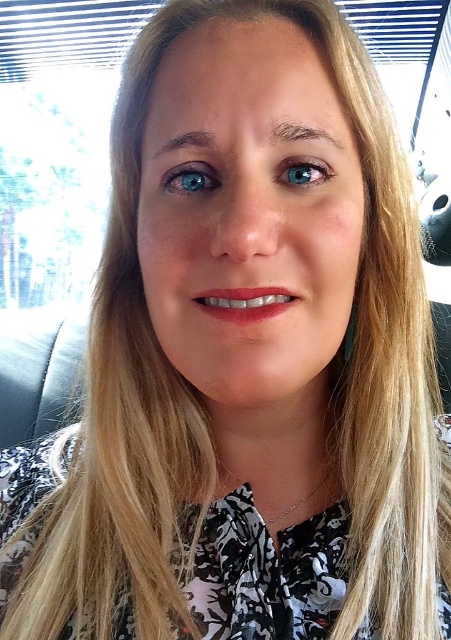
Question: Does blue glossy eye at upper left appear under blue glossy eye at center?

Choices:
 (A) yes
 (B) no

Answer: (B)

Question: Which of the following is the closest to the observer?

Choices:
 (A) (194, 193)
 (B) (289, 179)

Answer: (B)

Question: Can you confirm if blue glossy eye at upper left is positioned to the right of blue glossy eye at center?

Choices:
 (A) no
 (B) yes

Answer: (A)

Question: Considering the relative positions of blue glossy eye at upper left and blue glossy eye at center in the image provided, where is blue glossy eye at upper left located with respect to blue glossy eye at center?

Choices:
 (A) left
 (B) right

Answer: (A)

Question: Which object appears farthest from the camera in this image?

Choices:
 (A) blue glossy eye at upper left
 (B) blue glossy eye at center

Answer: (A)